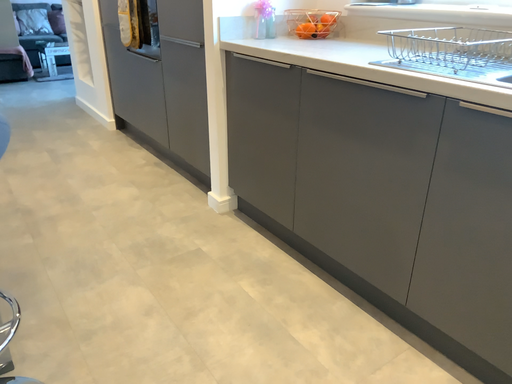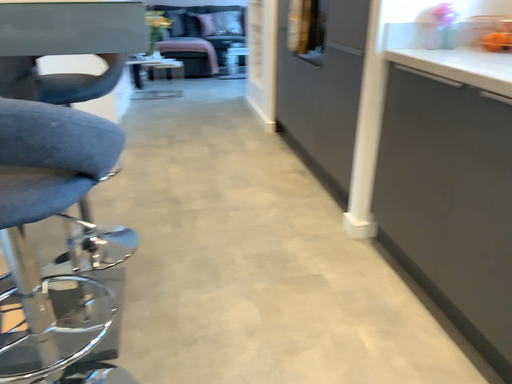
Question: How did the camera likely rotate when shooting the video?

Choices:
 (A) rotated right
 (B) rotated left

Answer: (B)